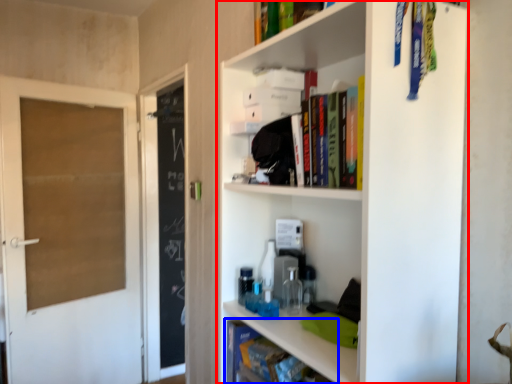
Question: Which object is further to the camera taking this photo, shelf (highlighted by a red box) or book (highlighted by a blue box)?

Choices:
 (A) shelf
 (B) book

Answer: (B)